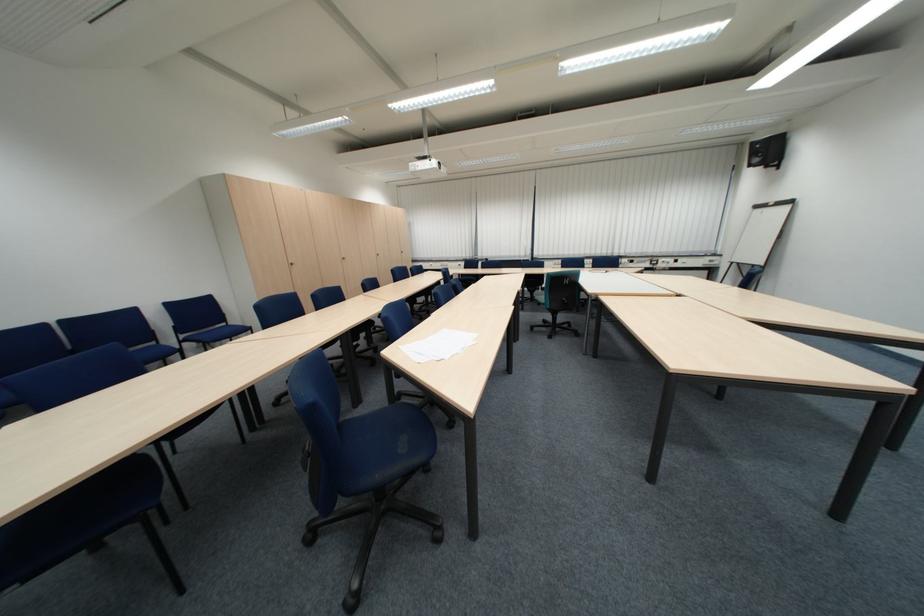
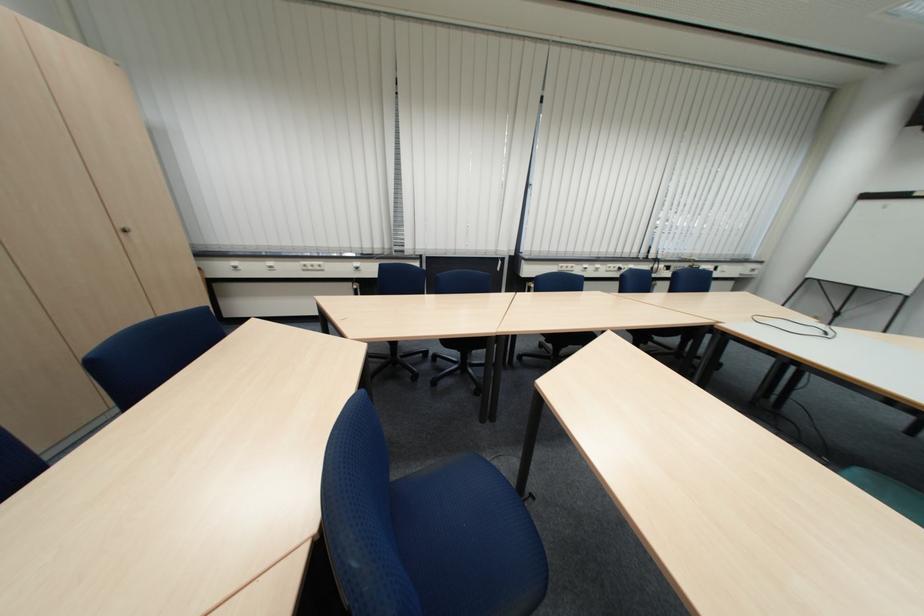
Question: The images are taken continuously from a first-person perspective. In which direction are you moving?

Choices:
 (A) Left
 (B) Right
 (C) Forward
 (D) Backward

Answer: (C)